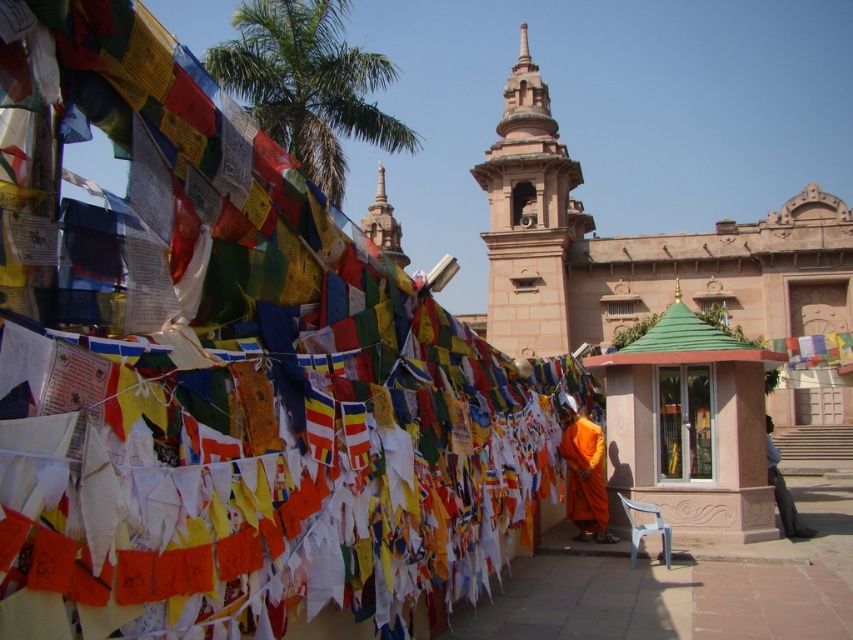
Who is taller, orange silk robe at center or orange cloth at lower right?

With more height is orange cloth at lower right.

Does point (589, 422) come in front of point (779, 456)?

Yes.

Is point (581, 486) closer to viewer compared to point (773, 477)?

Yes, it is.

Identify the location of orange silk robe at center. (585, 476).

Is green leafy palm tree at upper center above smooth stone stupa at center?

Yes, green leafy palm tree at upper center is above smooth stone stupa at center.

Does green leafy palm tree at upper center have a smaller size compared to smooth stone stupa at center?

Actually, green leafy palm tree at upper center might be larger than smooth stone stupa at center.

The width and height of the screenshot is (853, 640). Describe the element at coordinates (306, 84) in the screenshot. I see `green leafy palm tree at upper center` at that location.

The height and width of the screenshot is (640, 853). I want to click on green leafy palm tree at upper center, so click(306, 84).

Can you confirm if beige stone tower at center is smaller than smooth stone stupa at center?

Actually, beige stone tower at center might be larger than smooth stone stupa at center.

Based on the photo, can you confirm if beige stone tower at center is positioned to the left of smooth stone stupa at center?

Incorrect, beige stone tower at center is not on the left side of smooth stone stupa at center.

What do you see at coordinates (527, 218) in the screenshot? The image size is (853, 640). I see `beige stone tower at center` at bounding box center [527, 218].

You are a GUI agent. You are given a task and a screenshot of the screen. Output one action in this format:
    pyautogui.click(x=<x>, y=<y>)
    Task: Click on the beige stone tower at center
    The height and width of the screenshot is (640, 853).
    Given the screenshot: What is the action you would take?
    pyautogui.click(x=527, y=218)